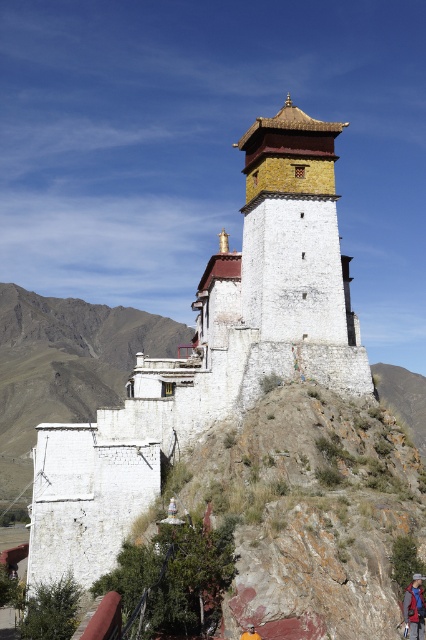
Based on the photo, you are a hiker who wants to retrieve the brown leather hat at center. The blue fabric backpack at center is blocking your path. Can you reach the hat without moving the backpack?

The brown leather hat at center is behind the blue fabric backpack at center, so you can reach it without moving the backpack by going around it or bending down.

You are standing at the base of the Tibetan monastery and looking up at the structure. There are two points marked on the building. One is at coordinate point (x=414, y=573) and the other at point (x=250, y=627). Which point is closer to you as you face the monastery?

Point (x=414, y=573) is closer to you because it is further to the viewer than point (x=250, y=627).

You are standing at the base of the Tibetan monastery and want to reach a specific point marked at coordinates point (207,369). If your maximum comfortable walking distance is 200 feet, will you be able to comfortably walk to that point?

The distance of point (207,369) from viewer is 216.10 feet, which exceeds your maximum comfortable walking distance of 200 feet. Therefore, you may find it uncomfortable to walk to that point.